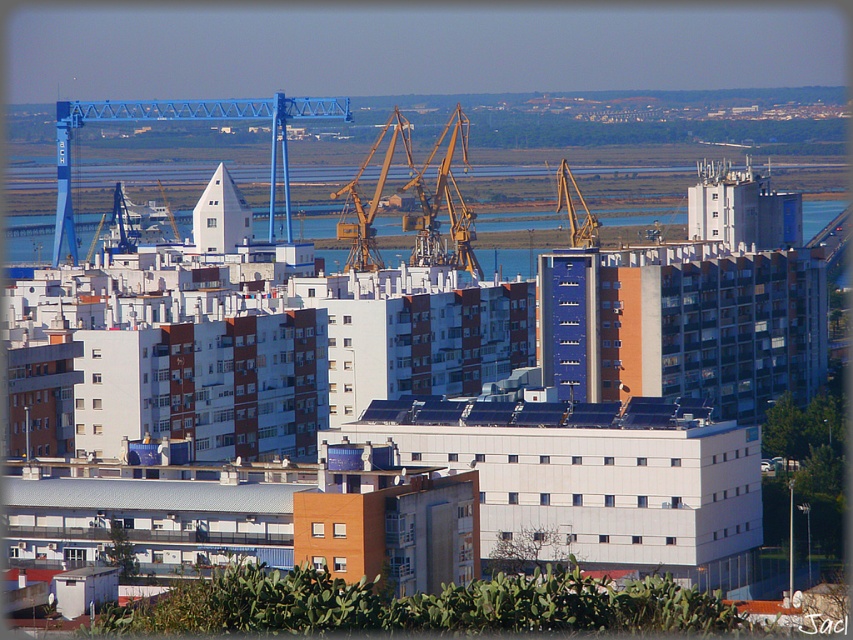
You are standing at the point with coordinates (x=184, y=120) in the urban landscape. What object is located exactly at your current position?

The blue metallic crane at upper center is located exactly at the point with coordinates (x=184, y=120).

You are a city planner reviewing this urban landscape. You need to determine the spatial relationship between the matte yellow crane at upper center and the blue water at center. From the perspective of an observer looking at the image, which object is positioned to the left?

The matte yellow crane at upper center is positioned to the left of the blue water at center.